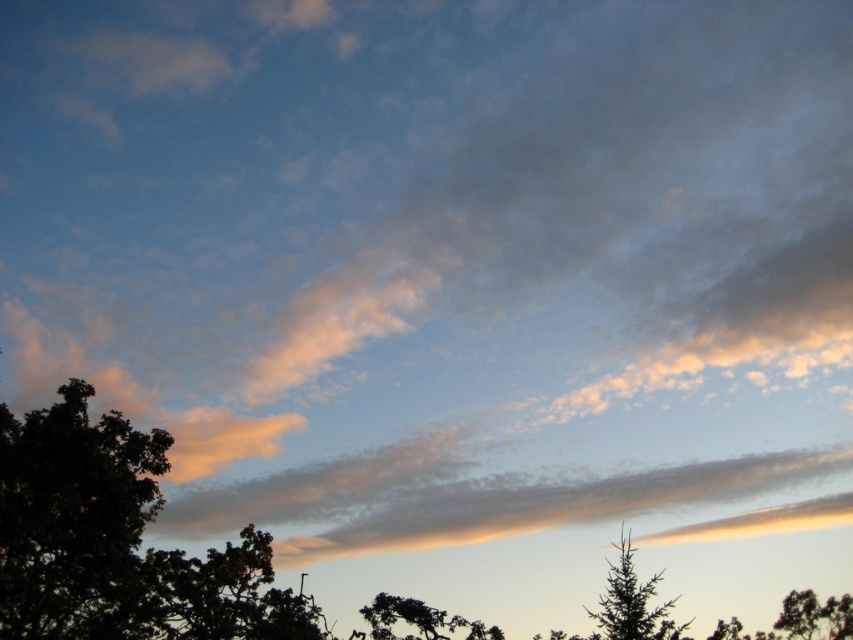
Question: Which object is farther from the camera taking this photo?

Choices:
 (A) silhouette textured tree at lower center
 (B) dark green leafy tree at lower left
 (C) green matte tree at lower right

Answer: (A)

Question: Does dark green leafy tree at lower left lie in front of green matte tree at lower right?

Choices:
 (A) no
 (B) yes

Answer: (A)

Question: Does green matte tree at lower right have a greater width compared to silhouette textured tree at lower center?

Choices:
 (A) no
 (B) yes

Answer: (A)

Question: Which object appears closest to the camera in this image?

Choices:
 (A) silhouette textured tree at lower center
 (B) green matte tree at lower right
 (C) dark green leafy tree at lower left

Answer: (B)

Question: Does dark green leafy tree at lower left appear under silhouette textured tree at lower center?

Choices:
 (A) yes
 (B) no

Answer: (B)

Question: Which point appears farthest from the camera in this image?

Choices:
 (A) (73, 602)
 (B) (630, 637)
 (C) (463, 621)

Answer: (C)